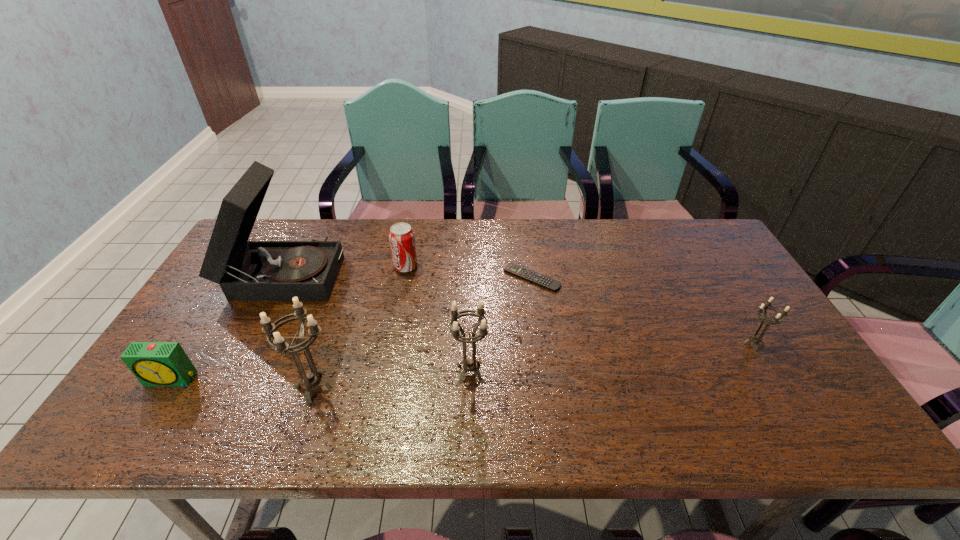
Please point a space for a new candle_holder to maintain equal intervals. Please provide its 2D coordinates. Your answer should be formatted as a tuple, i.e. [(x, y)], where the tuple contains the x and y coordinates of a point satisfying the conditions above.

[(615, 358)]